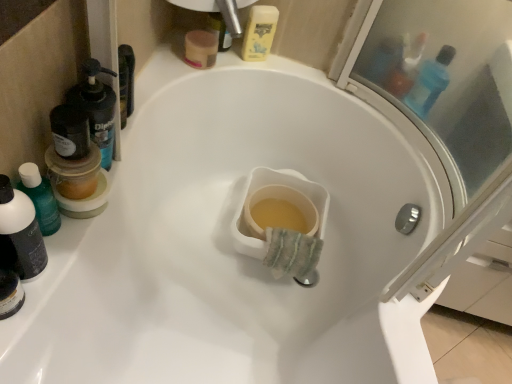
Question: Would you say yellow plastic mouthwash at upper center, which is the second mouthwash from right to left, is part of translucent plastic mouthwash at left, the fourth mouthwash viewed from the right,'s contents?

Choices:
 (A) no
 (B) yes

Answer: (A)

Question: Can you confirm if translucent plastic mouthwash at left, the first mouthwash positioned from the front, is shorter than yellow plastic mouthwash at upper center, the fourth mouthwash when ordered from bottom to top?

Choices:
 (A) yes
 (B) no

Answer: (B)

Question: Is translucent plastic mouthwash at left, acting as the 1th mouthwash starting from the bottom, smaller than yellow plastic mouthwash at upper center, which ranks as the 3th mouthwash in left-to-right order?

Choices:
 (A) no
 (B) yes

Answer: (B)

Question: Is translucent plastic mouthwash at left, the fourth mouthwash viewed from the right, oriented towards yellow plastic mouthwash at upper center, which is the second mouthwash from right to left?

Choices:
 (A) no
 (B) yes

Answer: (A)

Question: Is translucent plastic mouthwash at left, which is the fourth mouthwash in top-to-bottom order, at the right side of yellow plastic mouthwash at upper center, which ranks as the 3th mouthwash in left-to-right order?

Choices:
 (A) no
 (B) yes

Answer: (A)

Question: Is translucent plastic mouthwash at left, the fourth mouthwash when ordered from back to front, far away from yellow plastic mouthwash at upper center, the fourth mouthwash when ordered from bottom to top?

Choices:
 (A) yes
 (B) no

Answer: (B)

Question: Is translucent plastic mouthwash at left, the fourth mouthwash when ordered from back to front, outside of black plastic mouthwash at left, the third mouthwash viewed from the right?

Choices:
 (A) yes
 (B) no

Answer: (A)

Question: From the image's perspective, is translucent plastic mouthwash at left, which appears as the first mouthwash when viewed from the left, under black plastic mouthwash at left, the second mouthwash positioned from the left?

Choices:
 (A) yes
 (B) no

Answer: (A)

Question: Is translucent plastic mouthwash at left, the fourth mouthwash when ordered from back to front, facing towards black plastic mouthwash at left, the second mouthwash positioned from the left?

Choices:
 (A) yes
 (B) no

Answer: (B)

Question: Considering the relative sizes of translucent plastic mouthwash at left, which appears as the first mouthwash when viewed from the left, and black plastic mouthwash at left, the second mouthwash positioned from the front, in the image provided, is translucent plastic mouthwash at left, which appears as the first mouthwash when viewed from the left, taller than black plastic mouthwash at left, the second mouthwash positioned from the front,?

Choices:
 (A) no
 (B) yes

Answer: (A)

Question: Is translucent plastic mouthwash at left, the fourth mouthwash when ordered from back to front, behind black plastic mouthwash at left, the 3th mouthwash when ordered from top to bottom?

Choices:
 (A) no
 (B) yes

Answer: (A)

Question: Is translucent plastic mouthwash at left, the fourth mouthwash when ordered from back to front, surrounding black plastic mouthwash at left, which is the 3th mouthwash in back-to-front order?

Choices:
 (A) yes
 (B) no

Answer: (B)

Question: Considering the relative sizes of blue translucent bottle at upper right, which ranks as the 2th mouthwash in back-to-front order, and translucent plastic mouthwash at left, the first mouthwash positioned from the front, in the image provided, is blue translucent bottle at upper right, which ranks as the 2th mouthwash in back-to-front order, shorter than translucent plastic mouthwash at left, the first mouthwash positioned from the front,?

Choices:
 (A) yes
 (B) no

Answer: (A)